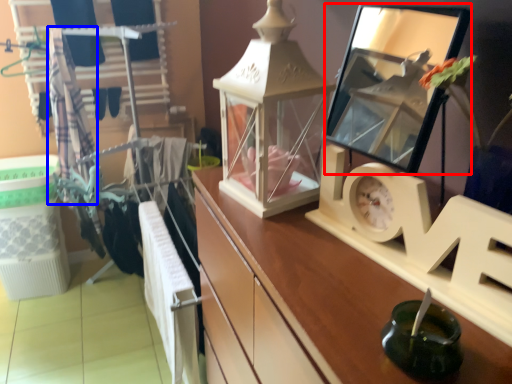
Question: Among these objects, which one is nearest to the camera, mirror (highlighted by a red box) or clothesline (highlighted by a blue box)?

Choices:
 (A) mirror
 (B) clothesline

Answer: (A)